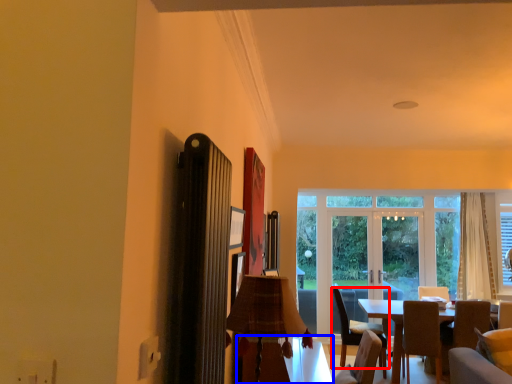
Question: Which object appears closest to the camera in this image, chair (highlighted by a red box) or table (highlighted by a blue box)?

Choices:
 (A) chair
 (B) table

Answer: (B)